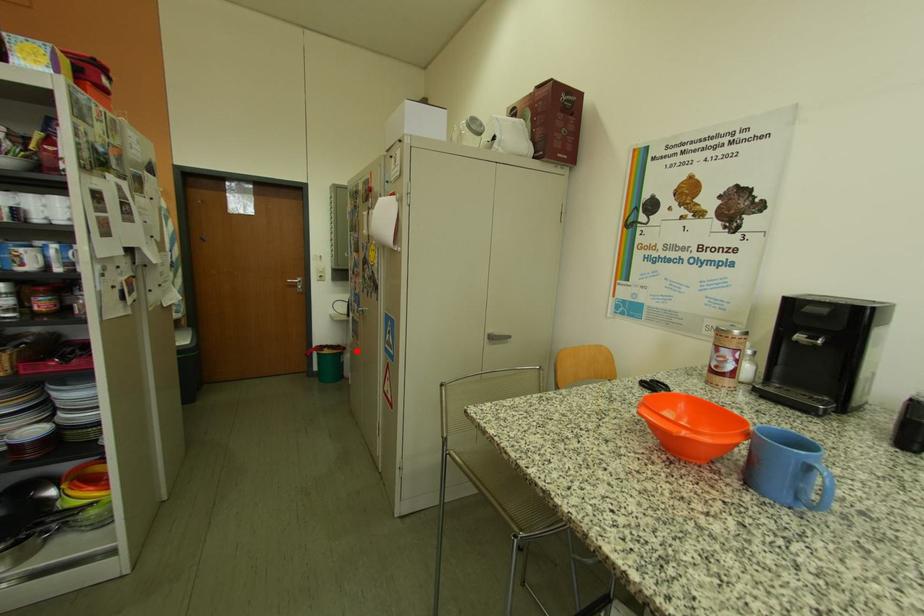
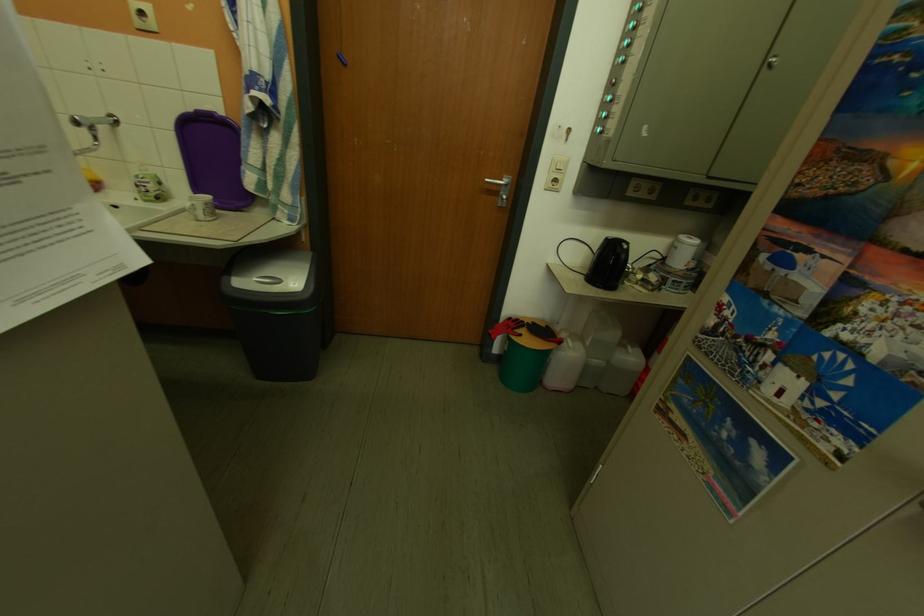
The point at the highlighted location is marked in the first image. Where is the corresponding point in the second image?

(574, 345)